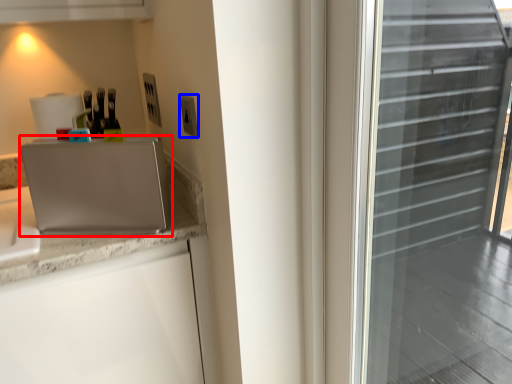
Question: Which object is further to the camera taking this photo, appliance (highlighted by a red box) or electric outlet (highlighted by a blue box)?

Choices:
 (A) appliance
 (B) electric outlet

Answer: (B)